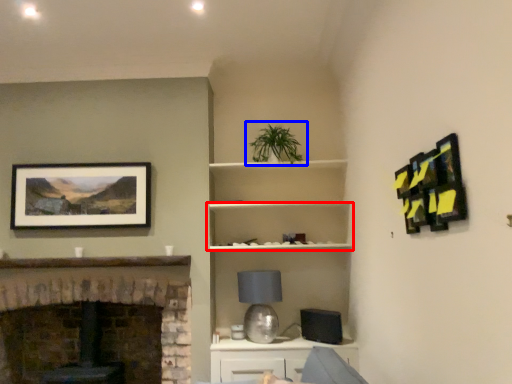
Question: Which object is closer to the camera taking this photo, shelf (highlighted by a red box) or houseplant (highlighted by a blue box)?

Choices:
 (A) shelf
 (B) houseplant

Answer: (B)